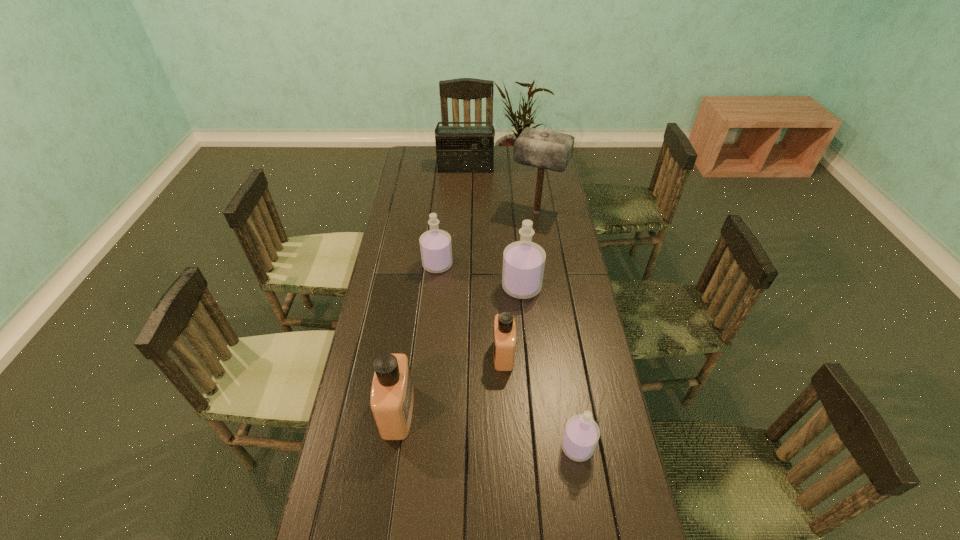
This screenshot has width=960, height=540. Find the location of `vacant point located between the nearer beige perfume and the sixth nearest object`. vacant point located between the nearer beige perfume and the sixth nearest object is located at coordinates (468, 312).

Where is `free space between the right beige perfume and the left beige perfume`? This screenshot has height=540, width=960. free space between the right beige perfume and the left beige perfume is located at coordinates (450, 383).

The image size is (960, 540). What are the coordinates of `object that is the sixth closest to the smallest purple perfume` in the screenshot? It's located at (459, 149).

Choose which object is the fifth nearest neighbor to the third farthest perfume. Please provide its 2D coordinates. Your answer should be formatted as a tuple, i.e. [(x, y)], where the tuple contains the x and y coordinates of a point satisfying the conditions above.

[(543, 149)]

Select which perfume is the second closest to the second smallest purple perfume. Please provide its 2D coordinates. Your answer should be formatted as a tuple, i.e. [(x, y)], where the tuple contains the x and y coordinates of a point satisfying the conditions above.

[(504, 344)]

Locate an element on the screen. The height and width of the screenshot is (540, 960). perfume identified as the closest to the leftmost purple perfume is located at coordinates (523, 261).

This screenshot has height=540, width=960. What are the coordinates of `purple perfume that is the nearest to the biggest purple perfume` in the screenshot? It's located at (435, 245).

The image size is (960, 540). Find the location of `purple perfume that is the closest to the smallest purple perfume`. purple perfume that is the closest to the smallest purple perfume is located at coordinates (523, 261).

The width and height of the screenshot is (960, 540). What are the coordinates of `free region that satisfies the following two spatial constraints: 1. on the back side of the smallest purple perfume; 2. on the front label of the fifth farthest object` in the screenshot? It's located at (563, 354).

Find the location of a particular element. The width and height of the screenshot is (960, 540). vacant space that satisfies the following two spatial constraints: 1. on the front panel of the nearest purple perfume; 2. on the left side of the gray radio receiver is located at coordinates (454, 447).